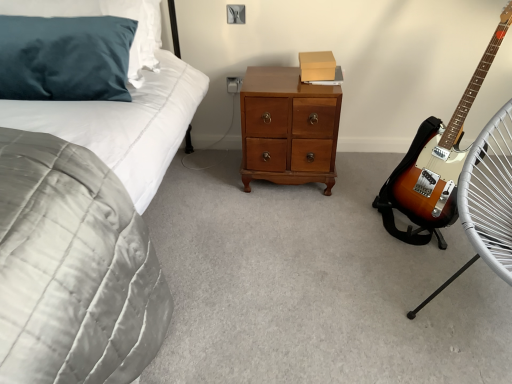
At what (x,y) coordinates should I click in order to perform the action: click on free area in between satin wood guitar at right and shiny brown wooden chest of drawers at center. Please return your answer as a coordinate pair (x, y). The image size is (512, 384). Looking at the image, I should click on (343, 188).